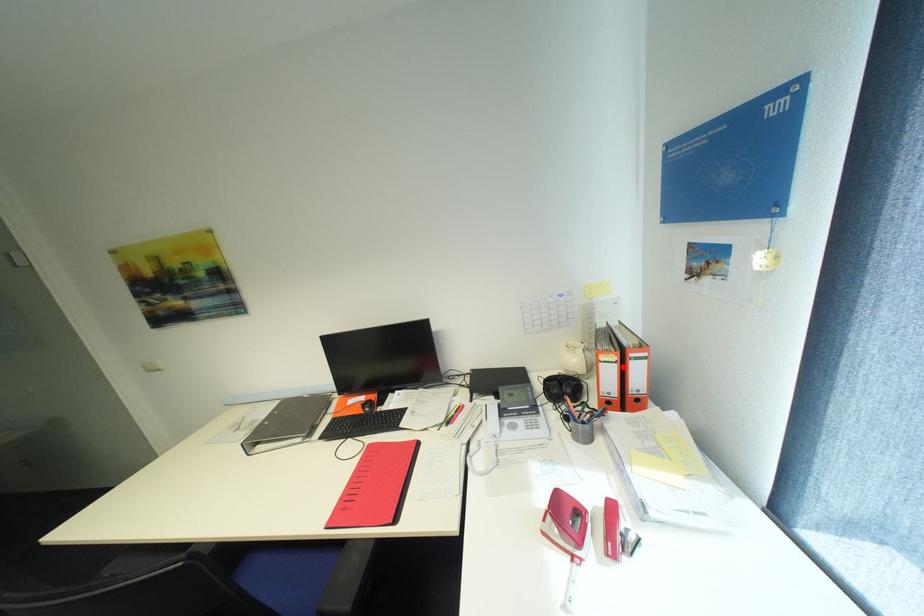
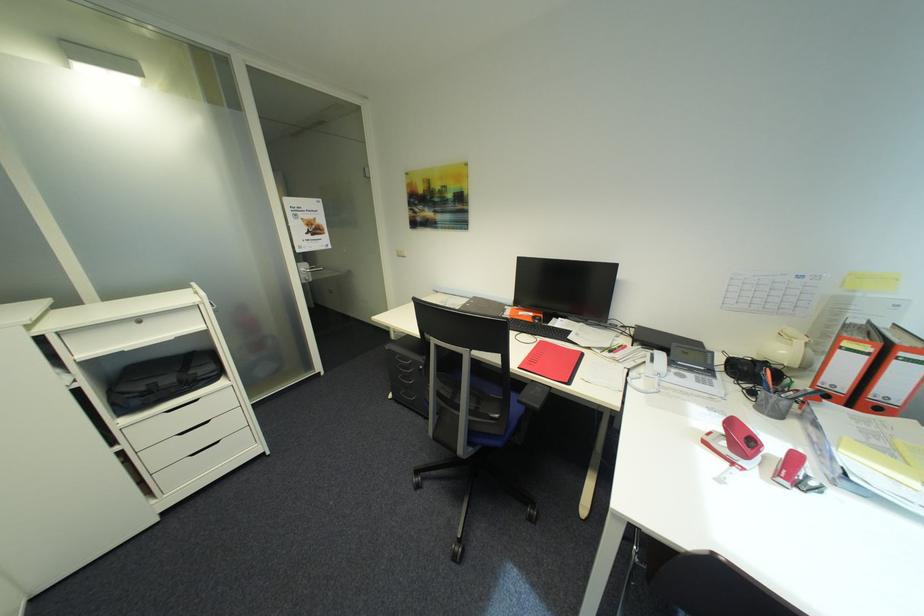
Where in the second image is the point corresponding to the highlighted location from the first image?

(872, 359)